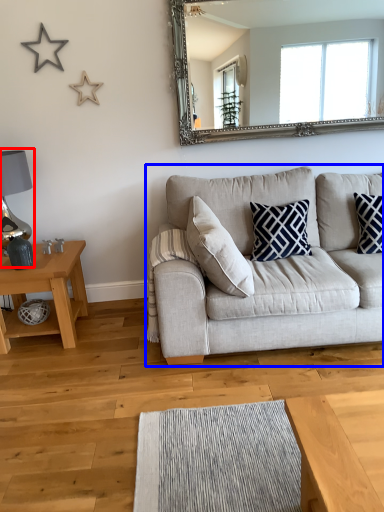
Question: Which object appears closest to the camera in this image, lamp (highlighted by a red box) or studio couch (highlighted by a blue box)?

Choices:
 (A) lamp
 (B) studio couch

Answer: (B)